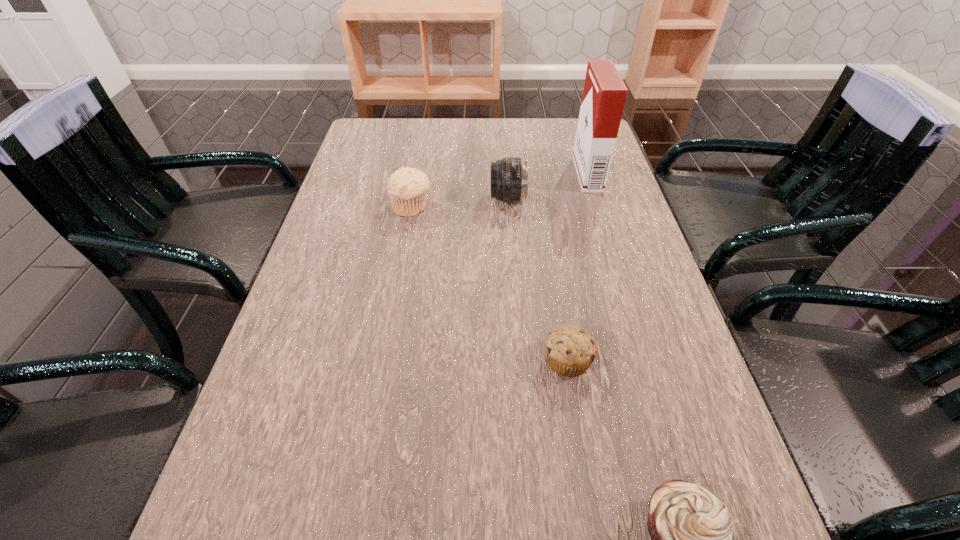
You are a GUI agent. You are given a task and a screenshot of the screen. Output one action in this format:
    pyautogui.click(x=<x>, y=<y>)
    Task: Click on the vacant space at the right edge of the desktop
    
    Given the screenshot: What is the action you would take?
    pyautogui.click(x=630, y=316)

In order to click on blank space at the far left corner of the desktop in this screenshot , I will do `click(369, 143)`.

The image size is (960, 540). In order to click on free point at the far right corner in this screenshot , I will do `click(571, 126)`.

At what (x,y) coordinates should I click in order to perform the action: click on vacant area that lies between the telephoto lens and the second muffin from right to left. Please return your answer as a coordinate pair (x, y). This screenshot has width=960, height=540. Looking at the image, I should click on (538, 279).

Identify the location of free space between the leftmost object and the telephoto lens. The width and height of the screenshot is (960, 540). (460, 203).

The image size is (960, 540). I want to click on empty space between the tallest object and the telephoto lens, so click(x=547, y=186).

Where is `free space between the telephoto lens and the leftmost muffin`? The image size is (960, 540). free space between the telephoto lens and the leftmost muffin is located at coordinates (460, 203).

Locate an element on the screen. The image size is (960, 540). empty location between the leftmost muffin and the telephoto lens is located at coordinates (460, 203).

Where is `vacant area that lies between the telephoto lens and the second farthest muffin`? The height and width of the screenshot is (540, 960). vacant area that lies between the telephoto lens and the second farthest muffin is located at coordinates (538, 279).

Identify which object is the third closest to the second farthest muffin. Please provide its 2D coordinates. Your answer should be formatted as a tuple, i.e. [(x, y)], where the tuple contains the x and y coordinates of a point satisfying the conditions above.

[(407, 187)]